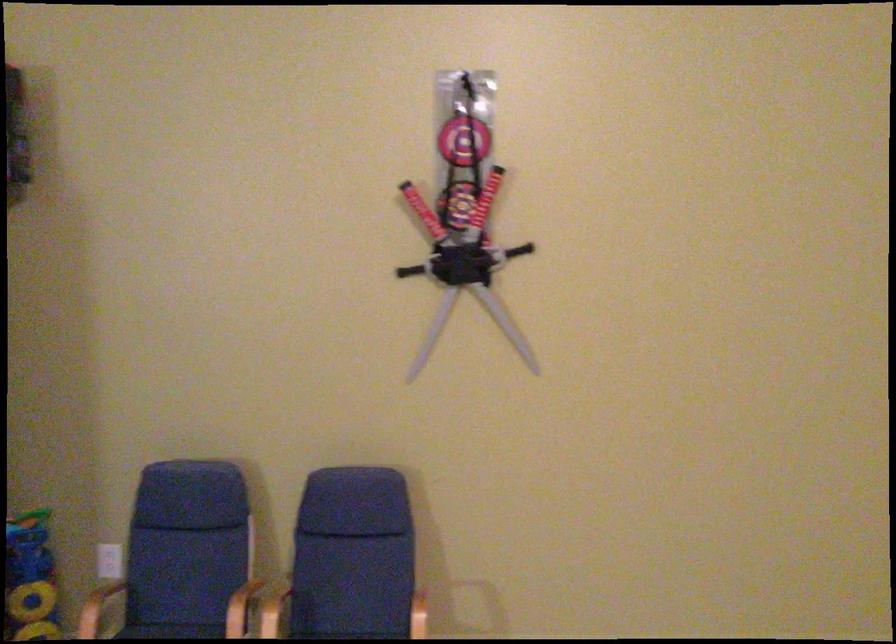
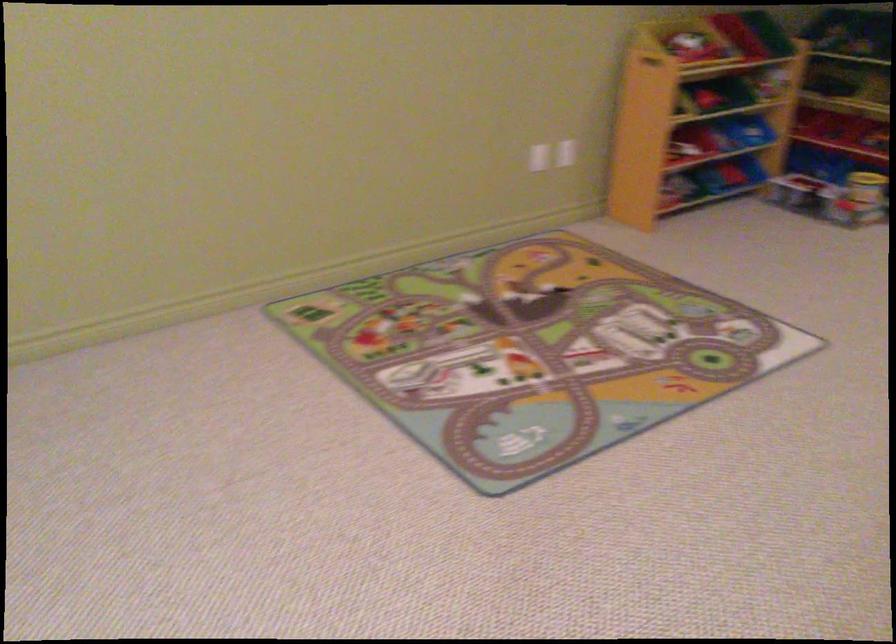
First-person continuous shooting, in which direction is the camera rotating?

The camera rotated toward right-down.